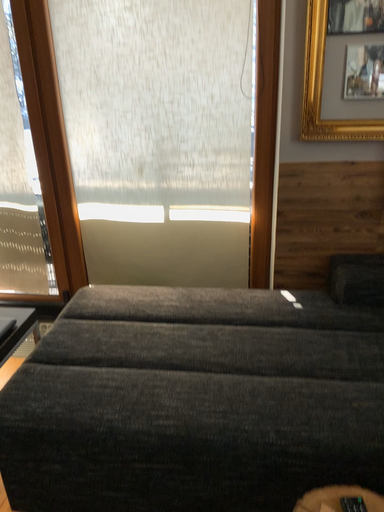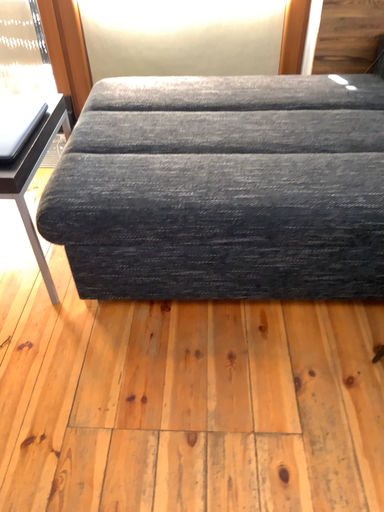
Question: How did the camera likely rotate when shooting the video?

Choices:
 (A) rotated downward
 (B) rotated upward

Answer: (A)